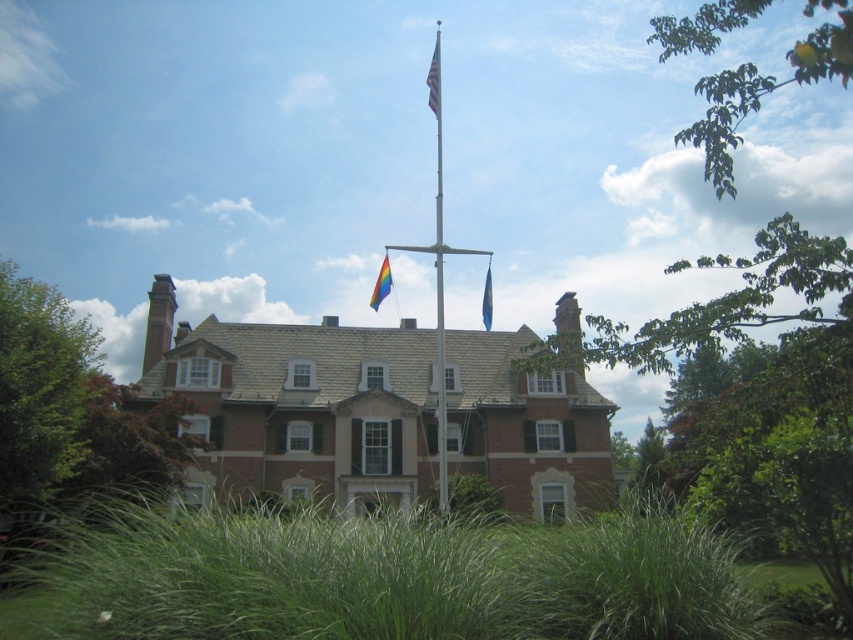
You are a guest at a housewarming party and want to take a photo with the flags. The American flag at center and the blue fabric flag at upper center are on the flagpole. Which flag should you stand closer to if you want both flags to appear the same size in your photo?

You should stand closer to the American flag at center because its width is smaller than the blue fabric flag at upper center, so moving closer will make them appear the same size in the photo.

Based on the photo, you are standing at the front yard of the house and see the flagpole with two flags. The American flag is at point (434,80). Which flag is higher on the flagpole?

The American flag at center is higher on the flagpole.